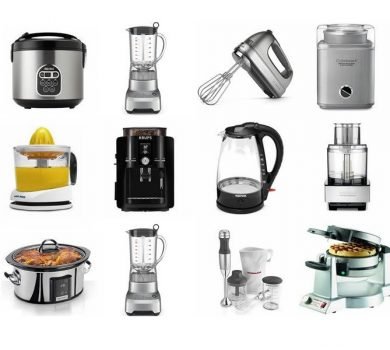
This screenshot has height=350, width=390. Find the location of `chrome self heating pot with glass lid`. chrome self heating pot with glass lid is located at coordinates (x=35, y=281).